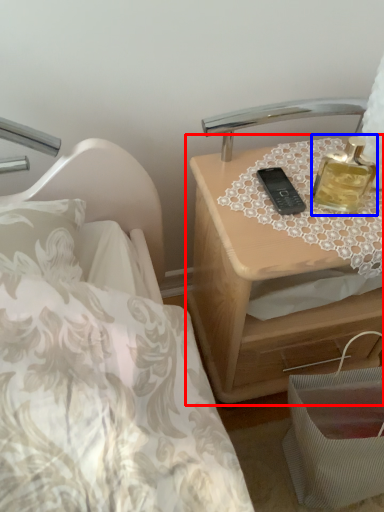
Question: Which point is closer to the camera, nightstand (highlighted by a red box) or perfume (highlighted by a blue box)?

Choices:
 (A) nightstand
 (B) perfume

Answer: (B)